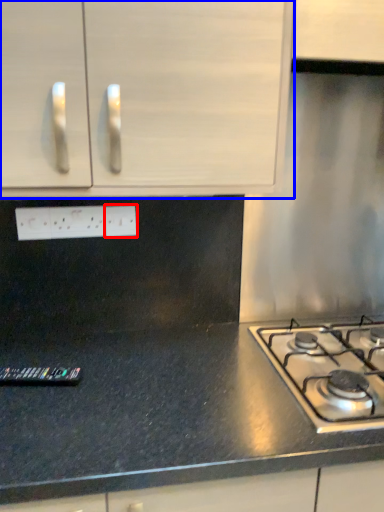
Question: Which object appears farthest to the camera in this image, electric outlet (highlighted by a red box) or cabinetry (highlighted by a blue box)?

Choices:
 (A) electric outlet
 (B) cabinetry

Answer: (A)